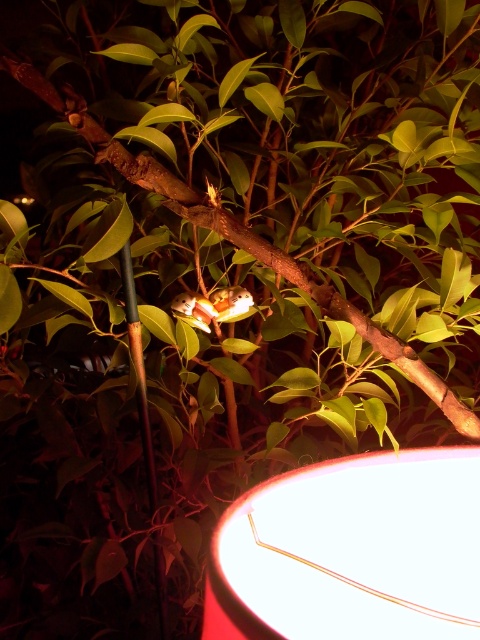
Is white glossy lampshade at lower right wider than green bamboo pole at left?

Yes.

Locate an element on the screen. Image resolution: width=480 pixels, height=640 pixels. white glossy lampshade at lower right is located at coordinates (351, 552).